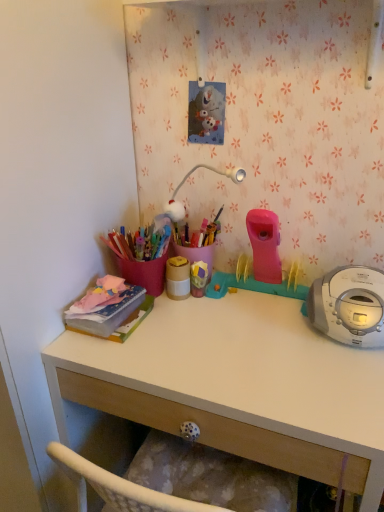
You are a GUI agent. You are given a task and a screenshot of the screen. Output one action in this format:
    pyautogui.click(x=<x>, y=<y>)
    Task: Click on the vacant space to the right of matte gold container at center, the 2th office supplies when ordered from left to right
    This screenshot has height=512, width=384.
    Given the screenshot: What is the action you would take?
    pyautogui.click(x=237, y=302)